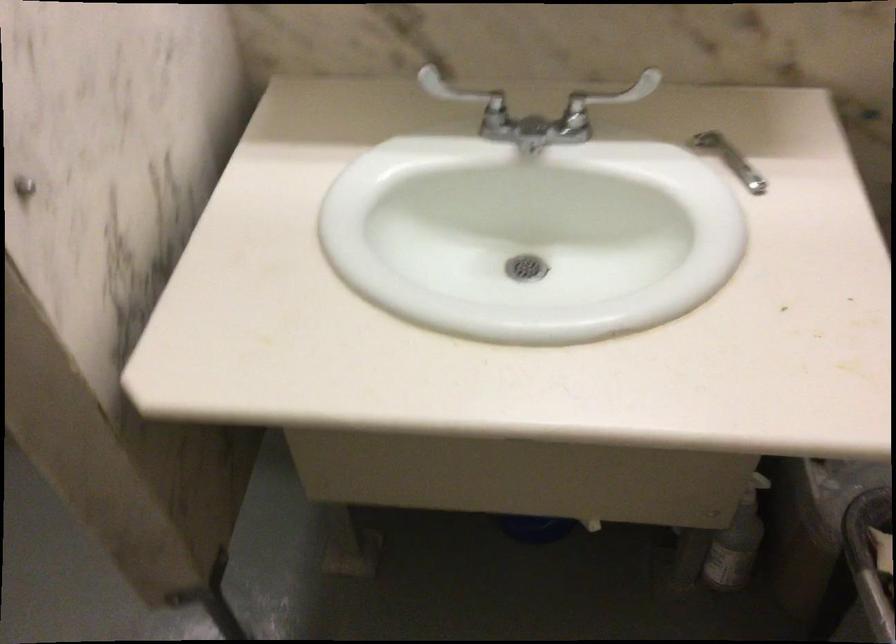
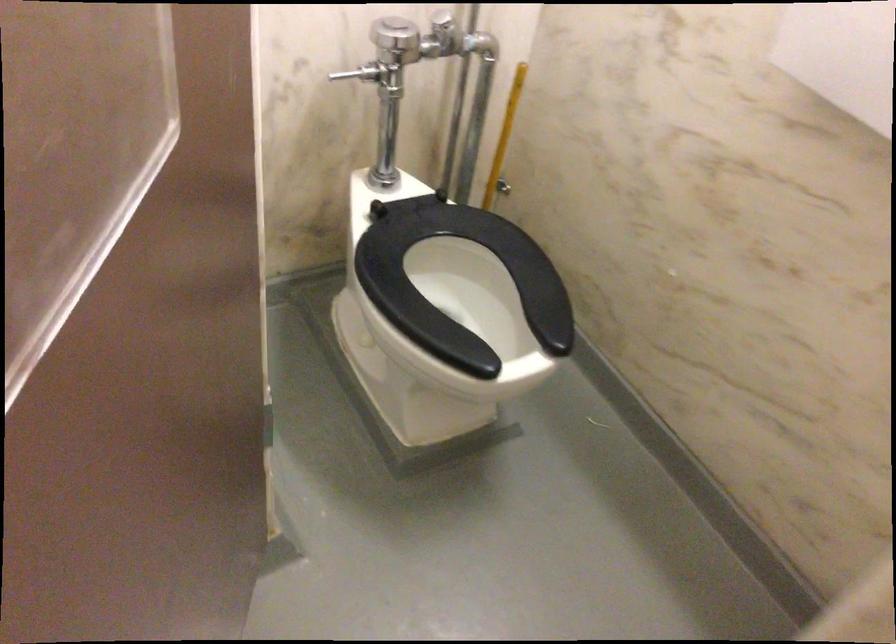
Question: The camera is either moving clockwise (left) or counter-clockwise (right) around the object. The first image is from the beginning of the video and the second image is from the end. Is the camera moving left or right when shooting the video?

Choices:
 (A) Left
 (B) Right

Answer: (B)